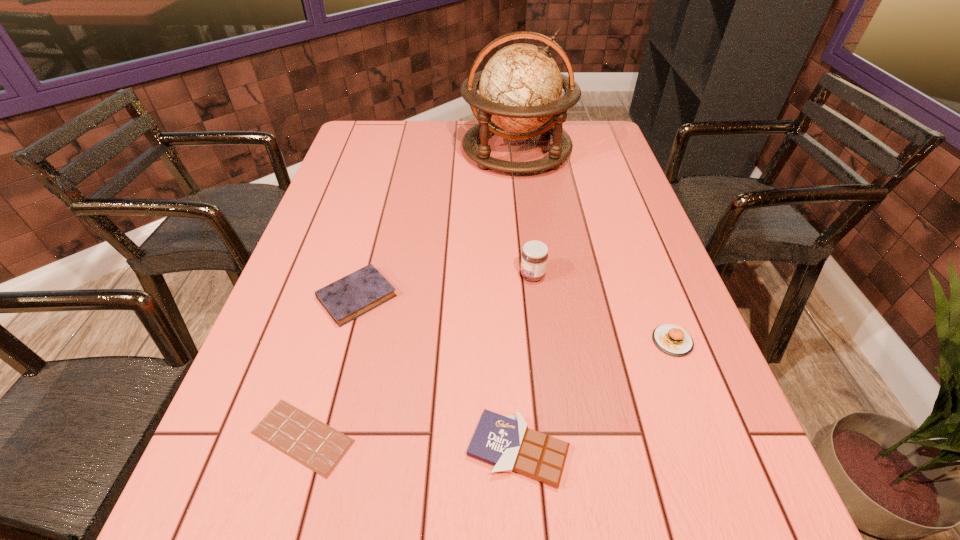
Where is `free space in the image that satisfies the following two spatial constraints: 1. on the back side of the rightmost object; 2. on the front label of the fifth shortest object`? Image resolution: width=960 pixels, height=540 pixels. free space in the image that satisfies the following two spatial constraints: 1. on the back side of the rightmost object; 2. on the front label of the fifth shortest object is located at coordinates (647, 275).

This screenshot has width=960, height=540. I want to click on vacant space that satisfies the following two spatial constraints: 1. on the back side of the food; 2. on the right side of the shortest object, so click(x=331, y=341).